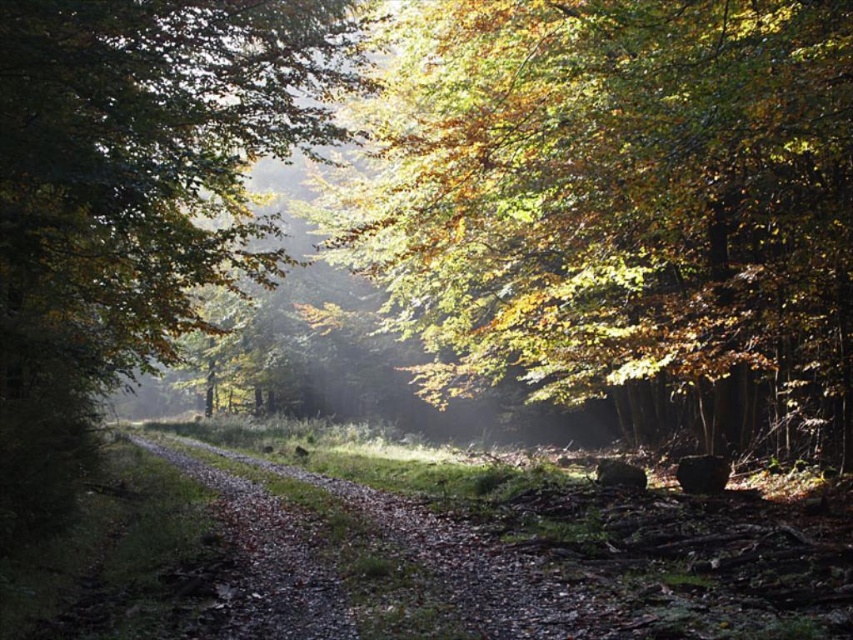
Question: Which point appears closest to the camera in this image?

Choices:
 (A) (183, 218)
 (B) (686, 60)

Answer: (B)

Question: Among these objects, which one is farthest from the camera?

Choices:
 (A) green leafy tree at center
 (B) golden leafy tree at center

Answer: (B)

Question: In this image, where is golden leafy tree at center located relative to green leafy tree at center?

Choices:
 (A) below
 (B) above

Answer: (A)

Question: Can you confirm if golden leafy tree at center is positioned to the left of green leafy tree at center?

Choices:
 (A) yes
 (B) no

Answer: (B)

Question: Does golden leafy tree at center have a lesser width compared to green leafy tree at center?

Choices:
 (A) yes
 (B) no

Answer: (B)

Question: Which object appears farthest from the camera in this image?

Choices:
 (A) golden leafy tree at center
 (B) green leafy tree at center

Answer: (A)